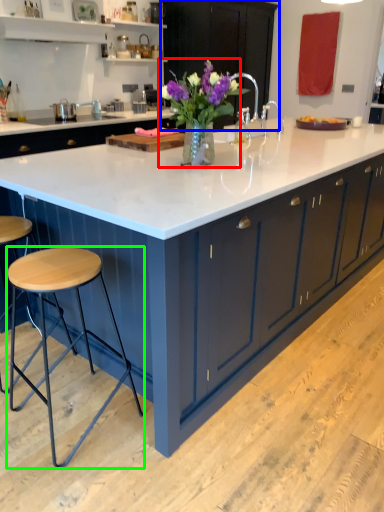
Question: Based on their relative distances, which object is farther from floral arrangement (highlighted by a red box)? Choose from cabinetry (highlighted by a blue box) and stool (highlighted by a green box).

Choices:
 (A) cabinetry
 (B) stool

Answer: (A)